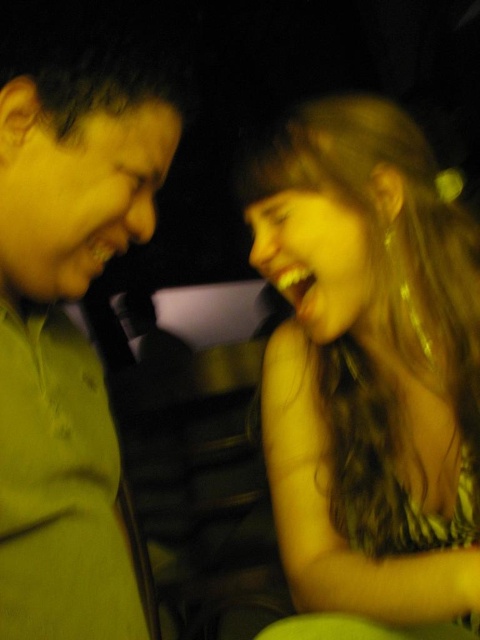
You are a photographer trying to capture a candid shot of both the shiny gold hair at right and the green matte shirt at left. Since you can only focus on one subject at a time, which one should you focus on to ensure the other is still in the frame?

The shiny gold hair at right is to the right of the green matte shirt at left, so focusing on the green matte shirt at left would keep the shiny gold hair at right within the frame since it is positioned to the right side.

You are a photographer adjusting your camera settings. You want to focus on the shiny gold hair at right without blurring the green matte shirt at left. Is this possible given their positions?

The shiny gold hair at right is further to the viewer than green matte shirt at left. Since the shiny gold hair is closer to you, you can focus on it while keeping the green matte shirt at left in focus by adjusting the depth of field appropriately.

You are a photographer trying to capture a closeup of both the shiny gold hair at right and the green matte shirt at left in the scene. Given that your camera has a maximum focus range of 12 inches, will you be able to capture both subjects in focus?

The shiny gold hair at right and green matte shirt at left are 11.91 inches apart from each other, which is within the camera maximum focus range of 12 inches. Therefore, the photographer can capture both subjects in focus.